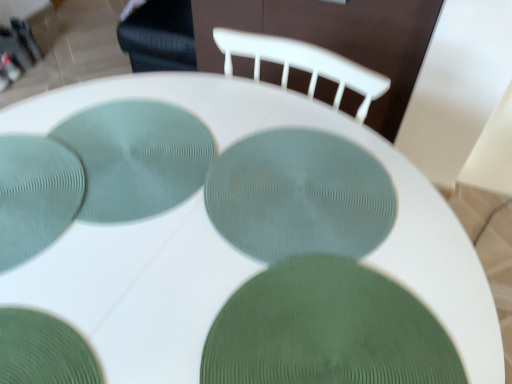
Find the location of a particular element. The image size is (512, 384). vacant space in front of matte green plate at center, acting as the fourth glass plate starting from the left is located at coordinates (303, 320).